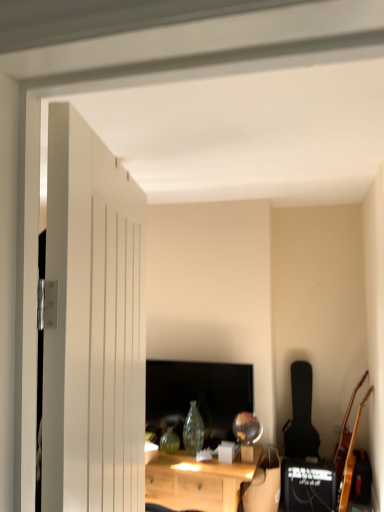
Question: Is light wood desk at center placed right next to black matte guitar at right, placed as the 2th guitar when sorted from right to left?

Choices:
 (A) no
 (B) yes

Answer: (A)

Question: Does light wood desk at center have a smaller size compared to black matte guitar at right, placed as the 2th guitar when sorted from right to left?

Choices:
 (A) yes
 (B) no

Answer: (B)

Question: Is light wood desk at center oriented towards black matte guitar at right, the first guitar from the left?

Choices:
 (A) yes
 (B) no

Answer: (B)

Question: From a real-world perspective, is light wood desk at center over black matte guitar at right, the first guitar from the left?

Choices:
 (A) yes
 (B) no

Answer: (B)

Question: Considering the relative sizes of light wood desk at center and black matte guitar at right, the 1th guitar when ordered from back to front, in the image provided, is light wood desk at center thinner than black matte guitar at right, the 1th guitar when ordered from back to front,?

Choices:
 (A) no
 (B) yes

Answer: (A)

Question: Is light wood desk at center wider than black matte guitar at right, placed as the 2th guitar when sorted from right to left?

Choices:
 (A) no
 (B) yes

Answer: (B)

Question: Does matte black monitor at center lie in front of wooden acoustic guitar at right, arranged as the second guitar when viewed from the back?

Choices:
 (A) yes
 (B) no

Answer: (B)

Question: Is matte black monitor at center oriented towards wooden acoustic guitar at right, arranged as the second guitar when viewed from the back?

Choices:
 (A) no
 (B) yes

Answer: (A)

Question: Is matte black monitor at center shorter than wooden acoustic guitar at right, the 2th guitar from the left?

Choices:
 (A) yes
 (B) no

Answer: (A)

Question: Is matte black monitor at center looking in the opposite direction of wooden acoustic guitar at right, the 1th guitar positioned from the right?

Choices:
 (A) no
 (B) yes

Answer: (A)

Question: Is matte black monitor at center further to camera compared to wooden acoustic guitar at right, the 1th guitar positioned from the right?

Choices:
 (A) no
 (B) yes

Answer: (B)

Question: Does matte black monitor at center have a greater height compared to wooden acoustic guitar at right, the 1th guitar positioned from the right?

Choices:
 (A) yes
 (B) no

Answer: (B)

Question: Is black matte guitar at right, the first guitar from the left, further to the viewer compared to black matte speaker at lower right?

Choices:
 (A) no
 (B) yes

Answer: (B)